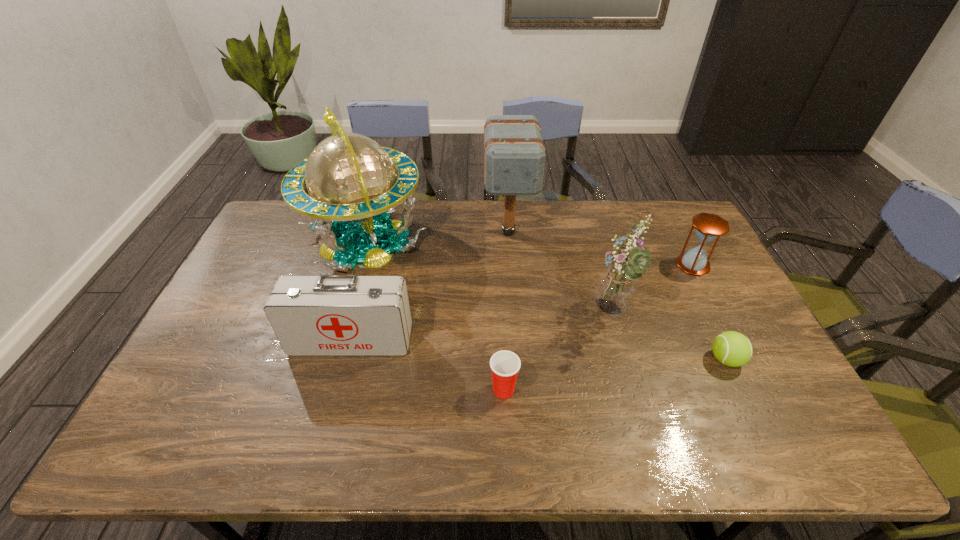
At what (x,y) coordinates should I click in order to perform the action: click on globe. Please return your answer as a coordinate pair (x, y). Looking at the image, I should click on (348, 185).

Locate an element on the screen. This screenshot has width=960, height=540. mallet is located at coordinates (514, 154).

At what (x,y) coordinates should I click in order to perform the action: click on the fifth object from left to right. Please return your answer as a coordinate pair (x, y). This screenshot has height=540, width=960. Looking at the image, I should click on (615, 289).

Locate an element on the screen. The height and width of the screenshot is (540, 960). the fourth shortest object is located at coordinates (328, 315).

Where is `the third shortest object`? This screenshot has width=960, height=540. the third shortest object is located at coordinates (708, 226).

Where is `Dixie cup`? The height and width of the screenshot is (540, 960). Dixie cup is located at coordinates (505, 365).

Locate an element on the screen. the second shortest object is located at coordinates (505, 365).

This screenshot has height=540, width=960. Identify the location of tennis ball. (733, 349).

In order to click on vacant point located on the front of the globe in this screenshot , I will do `click(326, 371)`.

Where is `free space located 0.270m on the striking surface of the mallet`? The image size is (960, 540). free space located 0.270m on the striking surface of the mallet is located at coordinates (515, 316).